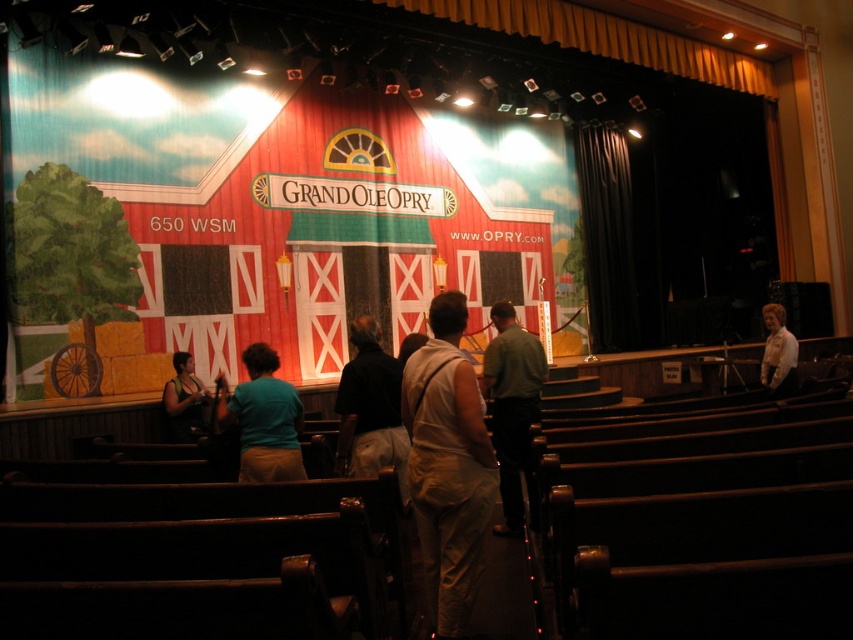
You are a stagehand at the Grand Ole Opry preparing for a performance. You need to ensure that the matte black dress at center is visible to the audience. Considering the black velvet curtain at right, which object should you adjust to avoid blocking the view of the dress?

The black velvet curtain at right is larger in size than the matte black dress at center. To ensure the dress remains visible, you should adjust the black velvet curtain at right by moving it out of the way or ensuring it is not obscuring the dress.

You are a photographer positioned at the back of the Grand Ole Opry stage. You notice a matte black dress at center and a white shirt at right in your camera viewfinder. Which of these two items is closer to your current position?

The matte black dress at center is closer to your current position because it is in front of the white shirt at right.

You are a photographer at the Grand Ole Opry stage. You need to capture a wide shot of the performers wearing the matte black dress at center and the white shirt at right. Given that the camera frame can only accommodate objects up to the width of the wider of the two, will both performers fit in the frame?

The matte black dress at center has a lesser width compared to white shirt at right. Since the camera frame can accommodate up to the width of the wider object, which is the white shirt at right, both performers will fit within the frame as the total width required does not exceed the frame capacity.